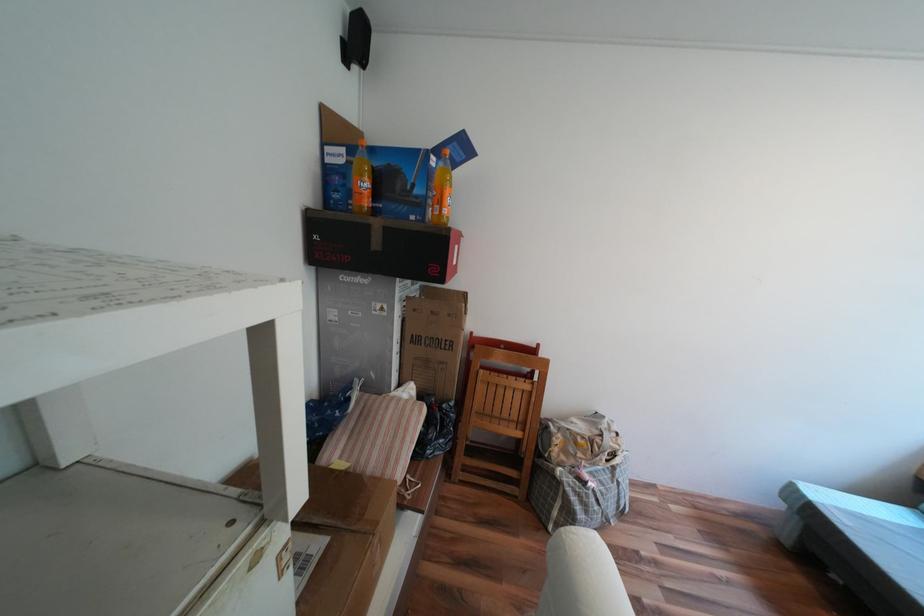
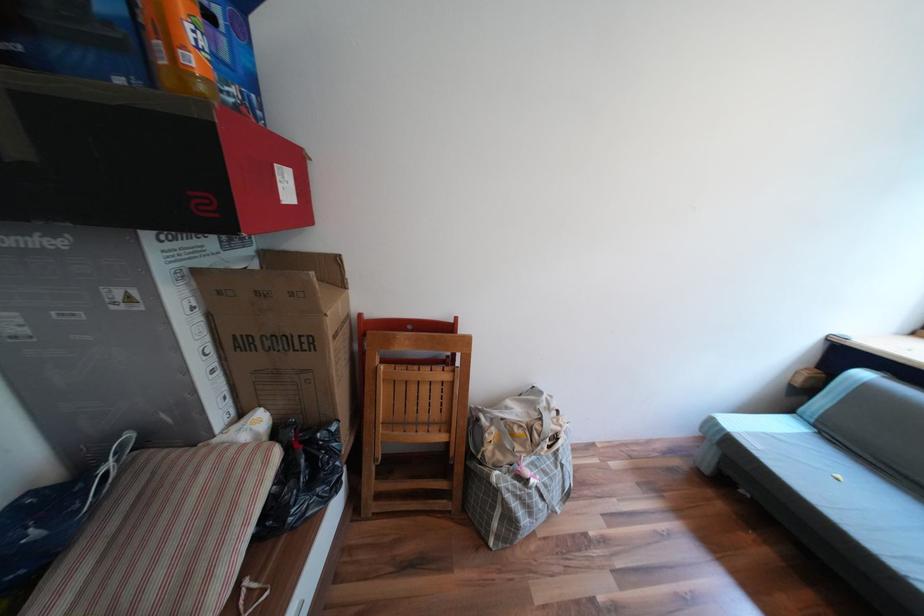
Which direction would the cameraman need to move to produce the second image?

The cameraman walked toward right, forward.